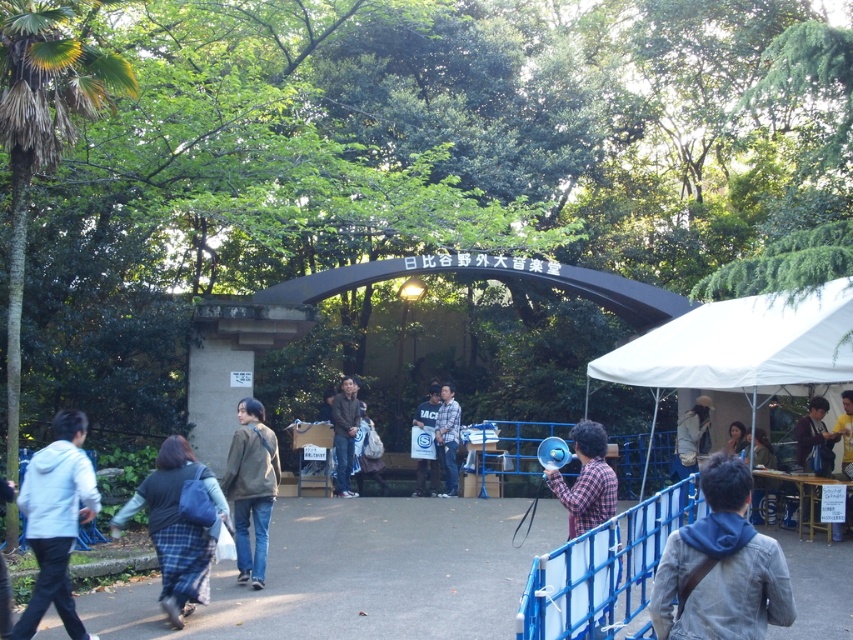
You are a photographer trying to capture a shot of the light brown hair at upper right without including the smooth asphalt path at center in the frame. Based on their positions, is this possible?

The smooth asphalt path at center is located below the light brown hair at upper right, so if you position your camera to focus on the upper area where the light brown hair at upper right is situated and avoid pointing downward towards the lower section where the path is, it should be possible to exclude the path from the frame.

You are a photographer trying to capture a candid shot of the gray hoodie at lower right and the dark brown hair at center. Which of the two subjects should you focus on first to ensure they are in frame before adjusting your camera settings?

The gray hoodie at lower right is smaller than the dark brown hair at center, so you should focus on the gray hoodie at lower right first since it requires more precise framing due to its smaller size.

You are a photographer positioned at the bottom left corner of the scene. You want to capture a photo that includes the plaid fabric megaphone at center. Which direction should you move to ensure the megaphone is centered in your frame?

The plaid fabric megaphone at center is located at point (587, 481) in the scene. Since you are at the bottom left corner, moving towards the right and slightly upwards will center the megaphone in your frame.